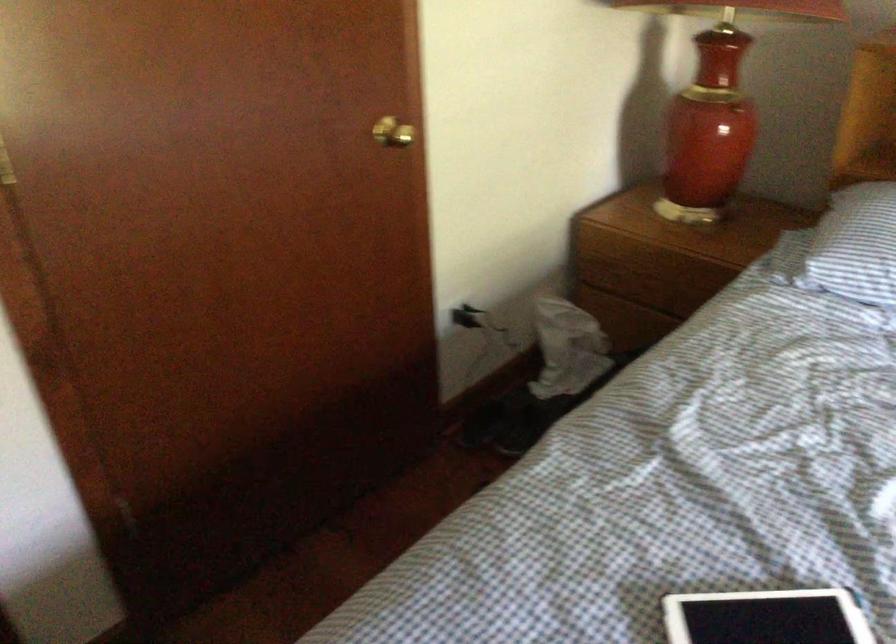
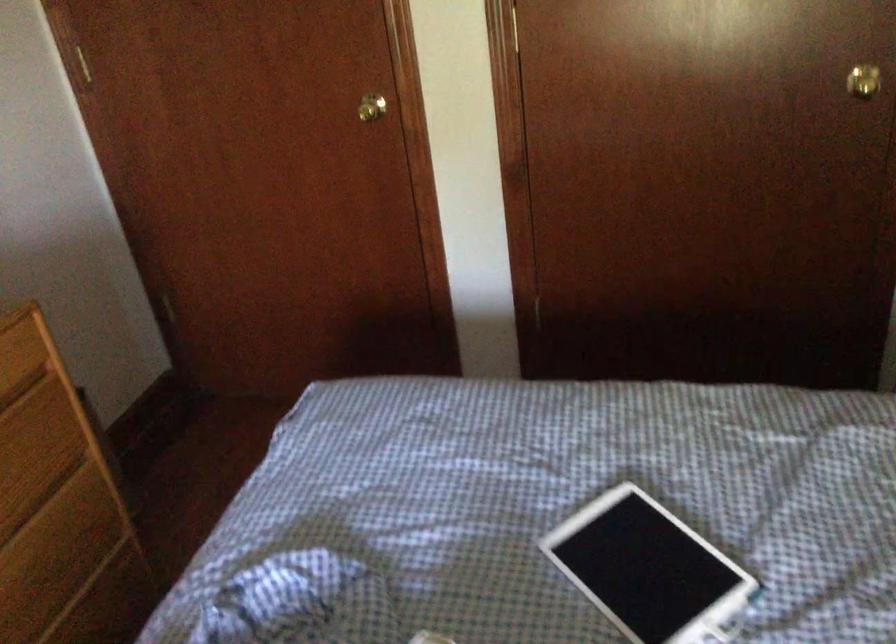
Question: The images are taken continuously from a first-person perspective. In which direction is your viewpoint rotating?

Choices:
 (A) Left
 (B) Right
 (C) Up
 (D) Down

Answer: (A)